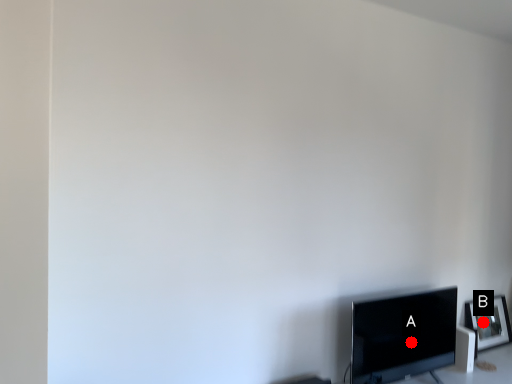
Question: Two points are circled on the image, labeled by A and B beside each circle. Which point is farther from the camera taking this photo?

Choices:
 (A) A is further
 (B) B is further

Answer: (B)